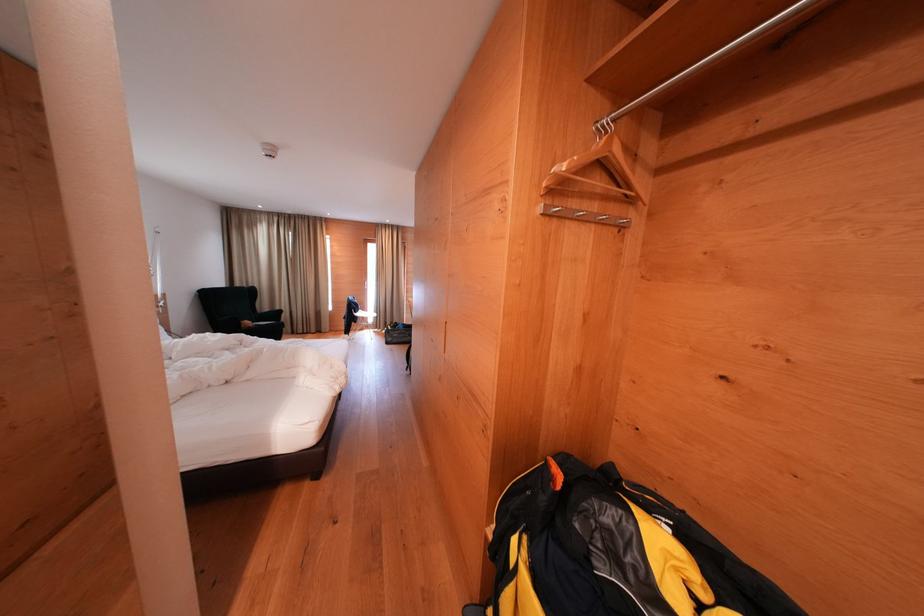
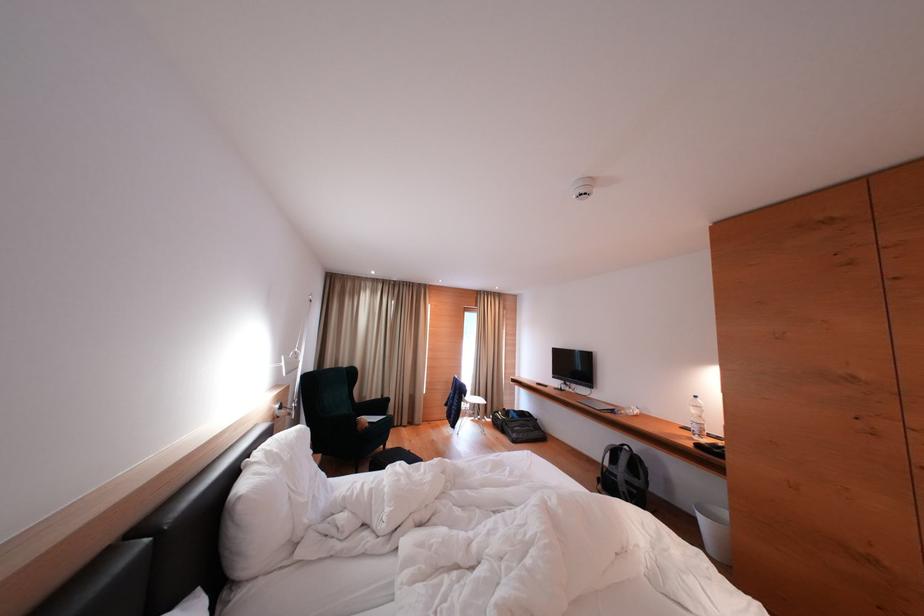
Find the pixel in the second image that matches the point at 407,331 in the first image.

(518, 418)